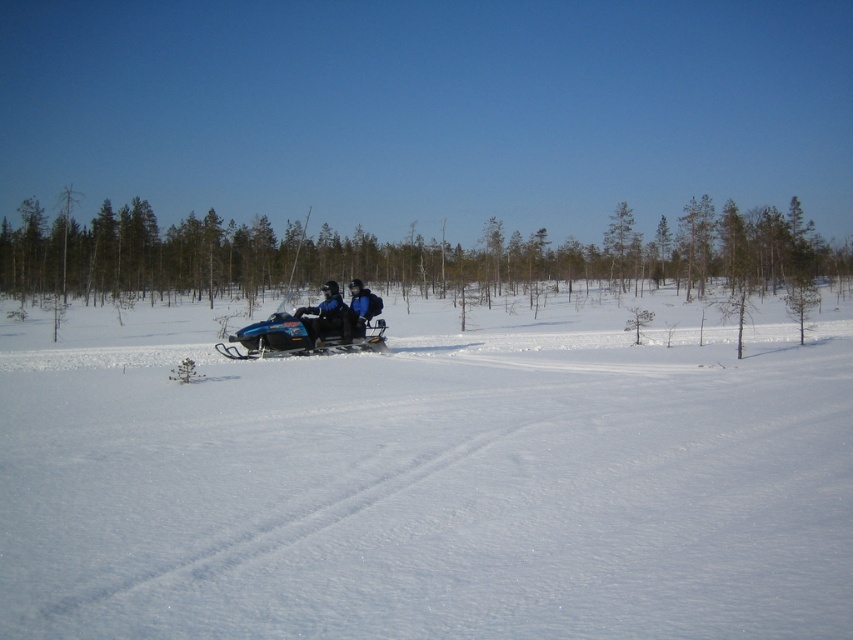
You are planning to build a snowman using the white powdery snow at center and need to place it on top of the blue plastic snowmobile at center. Will the snowman fit on the snowmobile without falling off?

The white powdery snow at center is not as tall as blue plastic snowmobile at center, so the snowman made from the white powdery snow at center will fit on the blue plastic snowmobile at center without falling off.